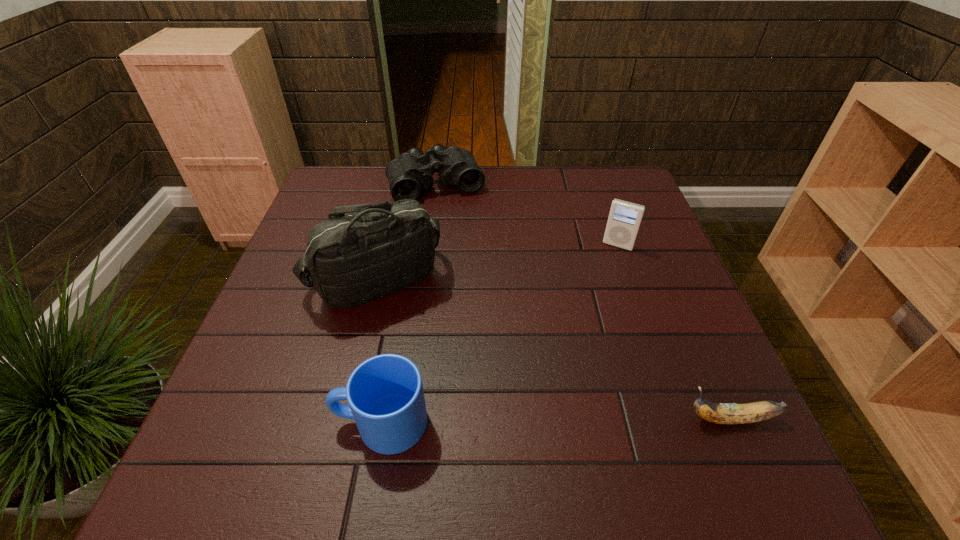
Image resolution: width=960 pixels, height=540 pixels. Identify the location of object located at the far edge. (409, 174).

The height and width of the screenshot is (540, 960). In order to click on mug that is at the near edge in this screenshot , I will do `click(385, 394)`.

The width and height of the screenshot is (960, 540). I want to click on banana situated at the near edge, so click(x=720, y=413).

At what (x,y) coordinates should I click in order to perform the action: click on object at the left edge. Please return your answer as a coordinate pair (x, y). Looking at the image, I should click on (363, 252).

Identify the location of banana present at the right edge. This screenshot has width=960, height=540. (720, 413).

Identify the location of iPod that is at the right edge. The width and height of the screenshot is (960, 540). (624, 220).

What are the coordinates of `object that is at the near right corner` in the screenshot? It's located at (720, 413).

Locate an element on the screen. Image resolution: width=960 pixels, height=540 pixels. blank area at the far edge is located at coordinates pyautogui.click(x=572, y=172).

Find the location of a particular element. The image size is (960, 540). vacant position at the near edge of the desktop is located at coordinates (575, 410).

Where is `free space at the left edge`? This screenshot has height=540, width=960. free space at the left edge is located at coordinates (291, 305).